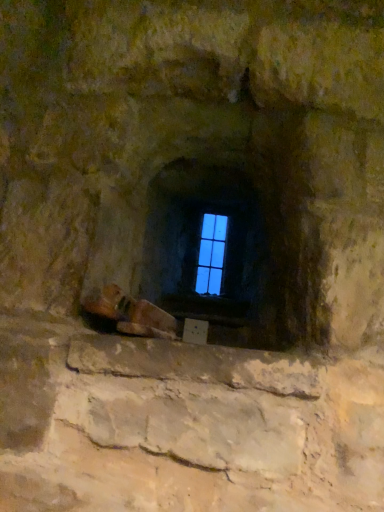
Question: From the image's perspective, is blue glass window at center above or below leather brown shoe at lower center?

Choices:
 (A) above
 (B) below

Answer: (A)

Question: Which is correct: blue glass window at center is inside leather brown shoe at lower center, or outside of it?

Choices:
 (A) inside
 (B) outside

Answer: (B)

Question: Is point (203, 245) positioned closer to the camera than point (155, 325)?

Choices:
 (A) farther
 (B) closer

Answer: (A)

Question: Considering the positions of leather brown shoe at lower center and blue glass window at center in the image, is leather brown shoe at lower center bigger or smaller than blue glass window at center?

Choices:
 (A) big
 (B) small

Answer: (A)

Question: From a real-world perspective, is leather brown shoe at lower center above or below blue glass window at center?

Choices:
 (A) above
 (B) below

Answer: (B)

Question: From the image's perspective, is leather brown shoe at lower center above or below blue glass window at center?

Choices:
 (A) below
 (B) above

Answer: (A)

Question: Which is correct: leather brown shoe at lower center is inside blue glass window at center, or outside of it?

Choices:
 (A) outside
 (B) inside

Answer: (A)